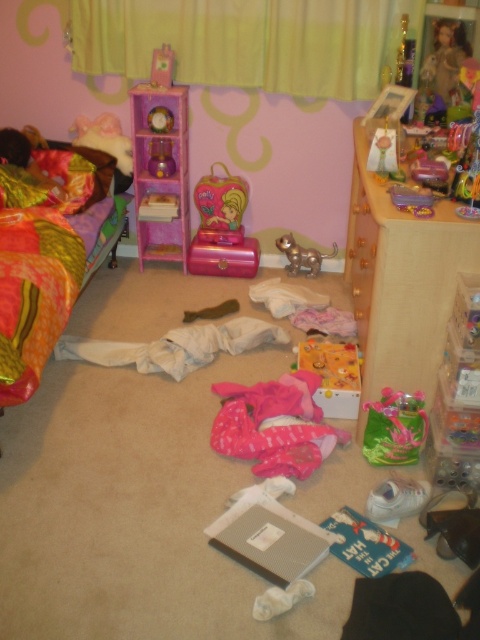
You are a parent trying to organize your child room. You have a wooden at right and a yellow plastic toy at center. Which object is wider?

The wooden at right is wider than the yellow plastic toy at center.

You are standing in the center of the room and want to reach both the point at coordinates (232, 227) and the point at coordinates (155, 138). Which point will you reach first?

You will reach point (232, 227) first because it is closer to you than point (155, 138), which is further away.

You are organizing the room and need to decide which item to move first. Since the yellow fabric curtain at upper center and the wooden at right are both in your way, which one is smaller and easier to move?

The yellow fabric curtain at upper center is smaller than the wooden at right, so it is easier to move.